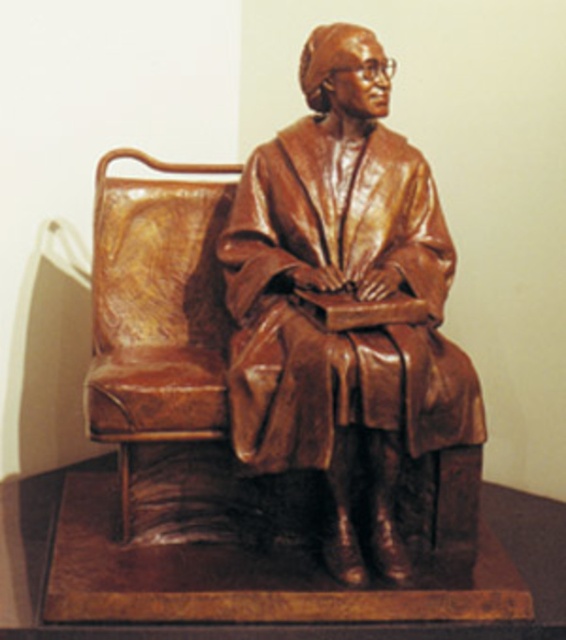
You are standing in front of the bronze statue at center and want to move to the brown leather armchair at left. Is the armchair behind the statue or in front of it?

The bronze statue at center is in front of the brown leather armchair at left, so the armchair is behind the statue.

You are an art conservator planning to install a protective glass enclosure around the bronze statue at center. The enclosure must be positioned precisely at the coordinates provided. What are the coordinates where you should place the enclosure?

The bronze statue at center is located at coordinates point [345,292], so the protective glass enclosure should be placed at those coordinates to ensure proper positioning.

You are an interior designer planning to place a new sofa in the living room. The bronze statue at center and the brown leather armchair at left are already present. Which object should you consider in terms of size when choosing the sofa to ensure proper spacing?

The bronze statue at center is larger in size than the brown leather armchair at left, so you should consider the bronze statue at center when choosing the sofa to ensure proper spacing.